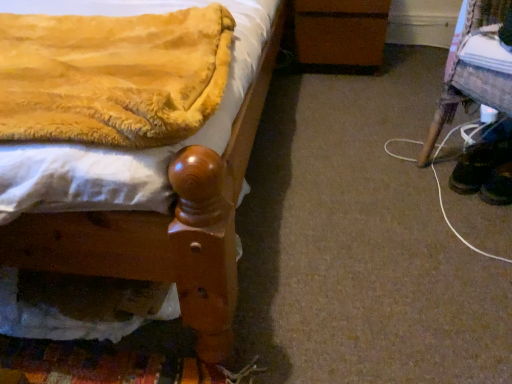
Where is `vacant area that lies between wooden stool at lower right and brown wooden changing table at center`? vacant area that lies between wooden stool at lower right and brown wooden changing table at center is located at coordinates (383, 96).